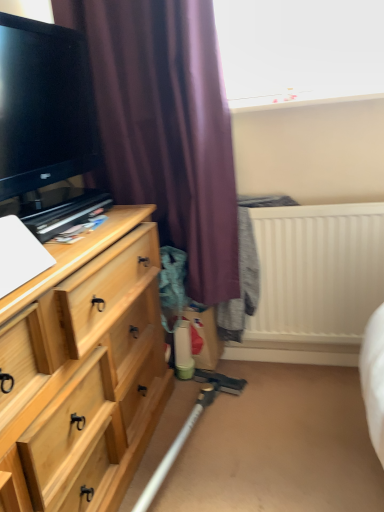
Question: Is black glossy tv at left further to camera compared to purple matte curtain at upper left?

Choices:
 (A) no
 (B) yes

Answer: (A)

Question: Does black glossy tv at left have a greater height compared to purple matte curtain at upper left?

Choices:
 (A) no
 (B) yes

Answer: (A)

Question: From the image's perspective, would you say black glossy tv at left is positioned over purple matte curtain at upper left?

Choices:
 (A) no
 (B) yes

Answer: (B)

Question: Does black glossy tv at left have a lesser width compared to purple matte curtain at upper left?

Choices:
 (A) yes
 (B) no

Answer: (A)

Question: Could you tell me if black glossy tv at left is facing purple matte curtain at upper left?

Choices:
 (A) no
 (B) yes

Answer: (B)

Question: From a real-world perspective, is black glossy tv at left on purple matte curtain at upper left?

Choices:
 (A) no
 (B) yes

Answer: (B)

Question: Is light wood chest of drawers at left further to camera compared to purple matte curtain at upper left?

Choices:
 (A) no
 (B) yes

Answer: (A)

Question: Would you say purple matte curtain at upper left is part of light wood chest of drawers at left's contents?

Choices:
 (A) no
 (B) yes

Answer: (A)

Question: Could you tell me if light wood chest of drawers at left is turned towards purple matte curtain at upper left?

Choices:
 (A) yes
 (B) no

Answer: (B)

Question: Is light wood chest of drawers at left wider than purple matte curtain at upper left?

Choices:
 (A) no
 (B) yes

Answer: (B)

Question: Does light wood chest of drawers at left have a larger size compared to purple matte curtain at upper left?

Choices:
 (A) no
 (B) yes

Answer: (B)

Question: Considering the relative positions of light wood chest of drawers at left and purple matte curtain at upper left in the image provided, is light wood chest of drawers at left to the right of purple matte curtain at upper left from the viewer's perspective?

Choices:
 (A) yes
 (B) no

Answer: (B)

Question: Does white plastic radiator at upper right have a greater width compared to light wood chest of drawers at left?

Choices:
 (A) no
 (B) yes

Answer: (A)